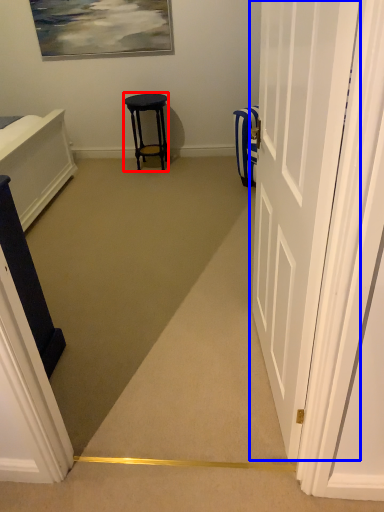
Question: Which object is further to the camera taking this photo, stool (highlighted by a red box) or door (highlighted by a blue box)?

Choices:
 (A) stool
 (B) door

Answer: (A)